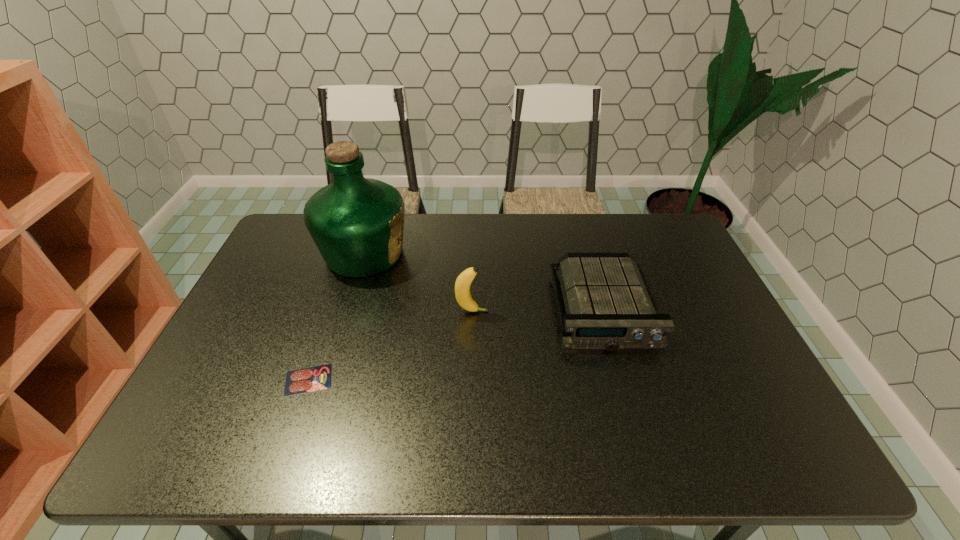
At what (x,y) coordinates should I click in order to perform the action: click on object that ranks as the second closest to the third tallest object. Please return your answer as a coordinate pair (x, y). Looking at the image, I should click on (357, 223).

This screenshot has width=960, height=540. I want to click on the second closest object to the tallest object, so click(x=316, y=378).

This screenshot has width=960, height=540. Find the location of `vacant position in the image that satisfies the following two spatial constraints: 1. from the stem of the third shortest object; 2. on the front side of the shortest object`. vacant position in the image that satisfies the following two spatial constraints: 1. from the stem of the third shortest object; 2. on the front side of the shortest object is located at coordinates (471, 380).

Identify the location of free location that satisfies the following two spatial constraints: 1. on the front panel of the radio receiver; 2. from the stem of the third object from left to right. (604, 312).

The width and height of the screenshot is (960, 540). Find the location of `vacant area in the image that satisfies the following two spatial constraints: 1. on the front panel of the rightmost object; 2. from the stem of the banana`. vacant area in the image that satisfies the following two spatial constraints: 1. on the front panel of the rightmost object; 2. from the stem of the banana is located at coordinates (604, 312).